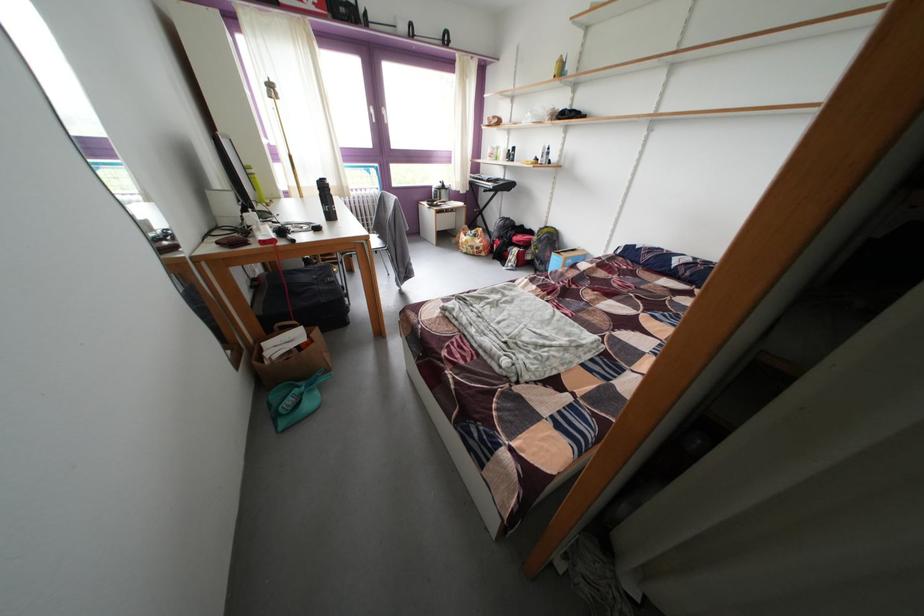
The width and height of the screenshot is (924, 616). I want to click on patterned tote bag, so click(x=473, y=241).